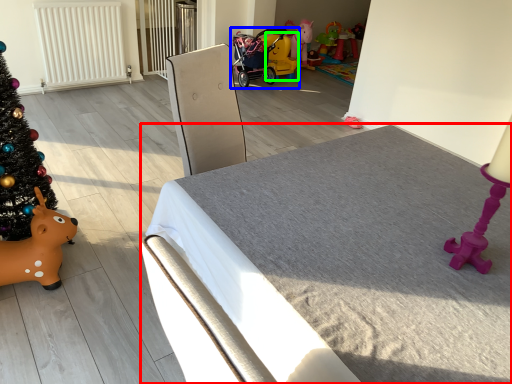
Question: Estimate the real-world distances between objects in this image. Which object is farther from furniture (highlighted by a red box), toy (highlighted by a blue box) or toy (highlighted by a green box)?

Choices:
 (A) toy
 (B) toy

Answer: (B)